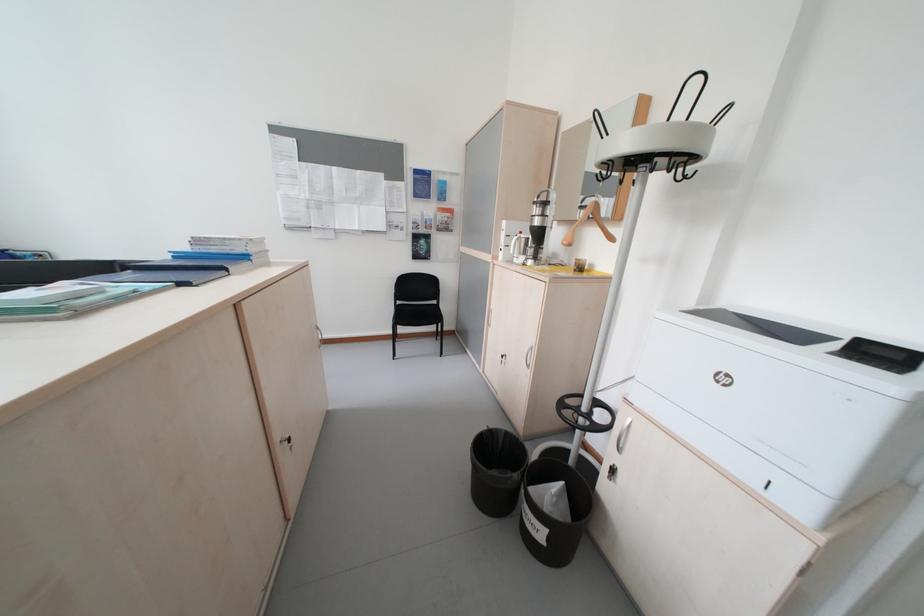
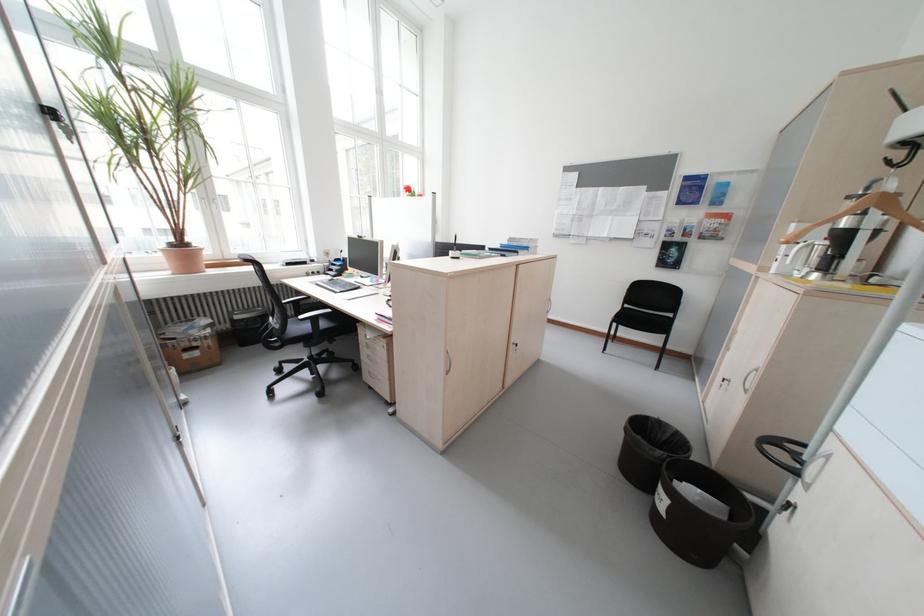
Question: The first image is from the beginning of the video and the second image is from the end. How did the camera likely rotate when shooting the video?

Choices:
 (A) Left
 (B) Right
 (C) Up
 (D) Down

Answer: (A)